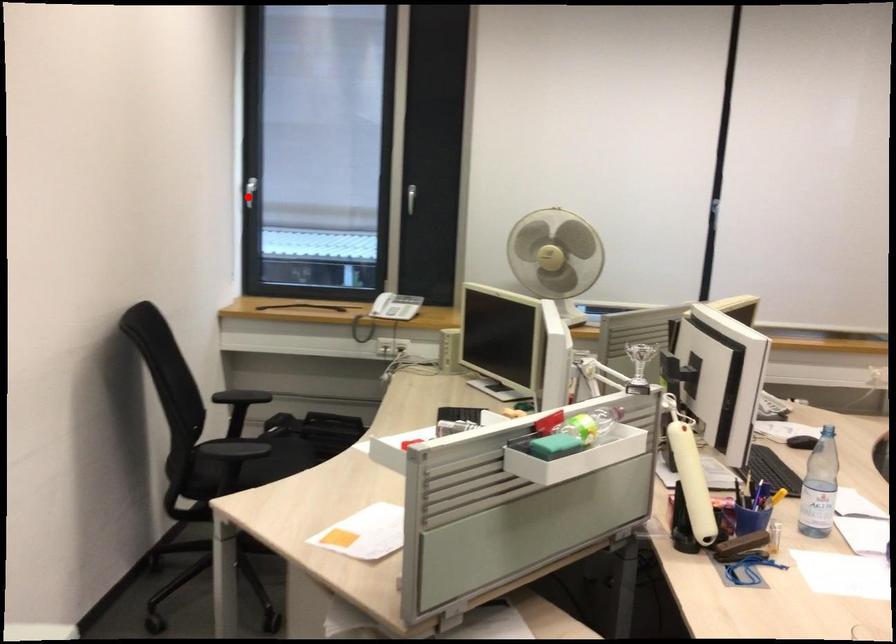
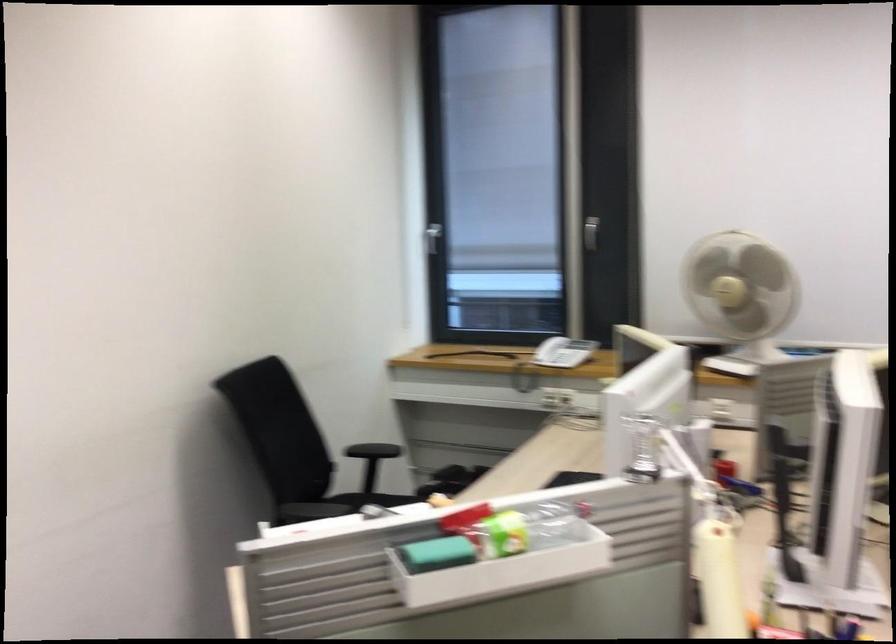
Locate, in the second image, the point that corresponds to the highlighted location in the first image.

(433, 238)